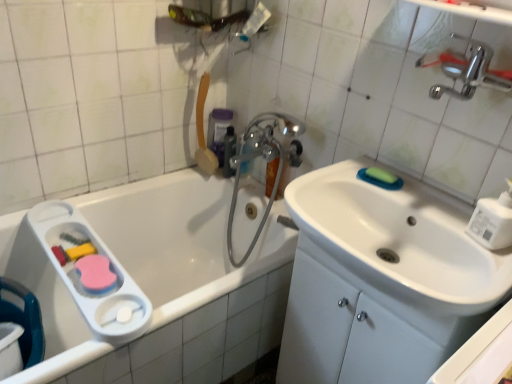
Locate an element on the screen. vacant point to the left of green matte soap at upper right is located at coordinates click(x=338, y=176).